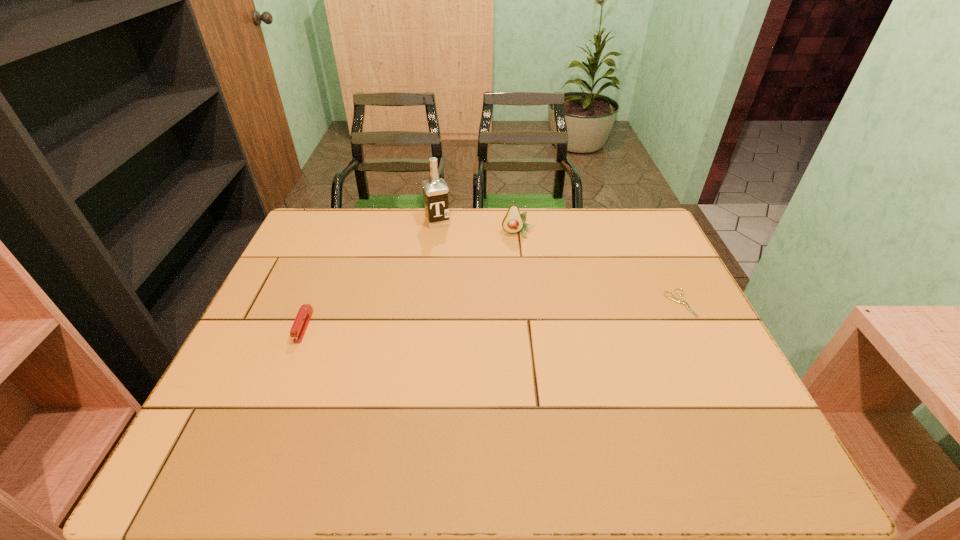
The image size is (960, 540). I want to click on vacant space at the far edge, so click(415, 221).

This screenshot has height=540, width=960. Find the location of `vacant area at the near edge of the desktop`. vacant area at the near edge of the desktop is located at coordinates (478, 399).

The image size is (960, 540). In order to click on vacant area at the left edge in this screenshot , I will do `click(286, 336)`.

In the image, there is a desktop. Identify the location of free space at the right edge. This screenshot has height=540, width=960. (707, 331).

The height and width of the screenshot is (540, 960). I want to click on vacant space at the near right corner, so click(x=748, y=402).

Where is `free area in between the third shortest object and the tallest object`? This screenshot has width=960, height=540. free area in between the third shortest object and the tallest object is located at coordinates (478, 227).

Locate an element on the screen. free space between the third object from left to right and the stapler is located at coordinates (411, 280).

Locate an element on the screen. free space between the rightmost object and the leftmost object is located at coordinates (492, 315).

At what (x,y) coordinates should I click in order to perform the action: click on free space between the shortest object and the third shortest object. Please return your answer as a coordinate pair (x, y). The image size is (960, 540). Looking at the image, I should click on tap(599, 268).

This screenshot has height=540, width=960. What are the coordinates of `free space between the shears and the avocado` in the screenshot? It's located at (599, 268).